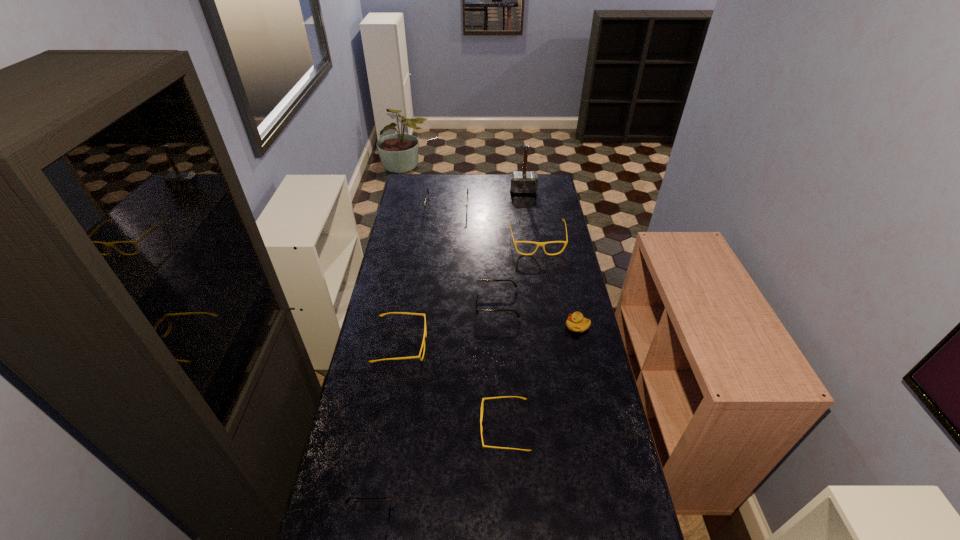
This screenshot has height=540, width=960. Find the location of `free region located at the hinge ends of the second farthest black spectacles`. free region located at the hinge ends of the second farthest black spectacles is located at coordinates (433, 303).

Where is `vacant space located 0.130m at the hinge ends of the second farthest black spectacles`? The width and height of the screenshot is (960, 540). vacant space located 0.130m at the hinge ends of the second farthest black spectacles is located at coordinates (443, 303).

Locate an element on the screen. free spot located at the hinge ends of the second farthest black spectacles is located at coordinates (403, 303).

Locate an element on the screen. vacant region located in front of the lenses of the second nearest object is located at coordinates [x=389, y=429].

The width and height of the screenshot is (960, 540). What are the coordinates of `vacant space located in front of the lenses of the second nearest object` in the screenshot? It's located at (461, 429).

Where is `free space located 0.340m in front of the lenses of the second nearest object`? This screenshot has height=540, width=960. free space located 0.340m in front of the lenses of the second nearest object is located at coordinates (372, 429).

I want to click on hammer present at the far edge, so [523, 182].

At what (x,y) coordinates should I click in order to perform the action: click on spectacles that is positioned at the far edge. Please return your answer as a coordinate pair (x, y). This screenshot has height=540, width=960. Looking at the image, I should click on (432, 210).

I want to click on hammer that is at the right edge, so click(x=523, y=182).

Locate an element on the screen. spectacles located at the right edge is located at coordinates (538, 244).